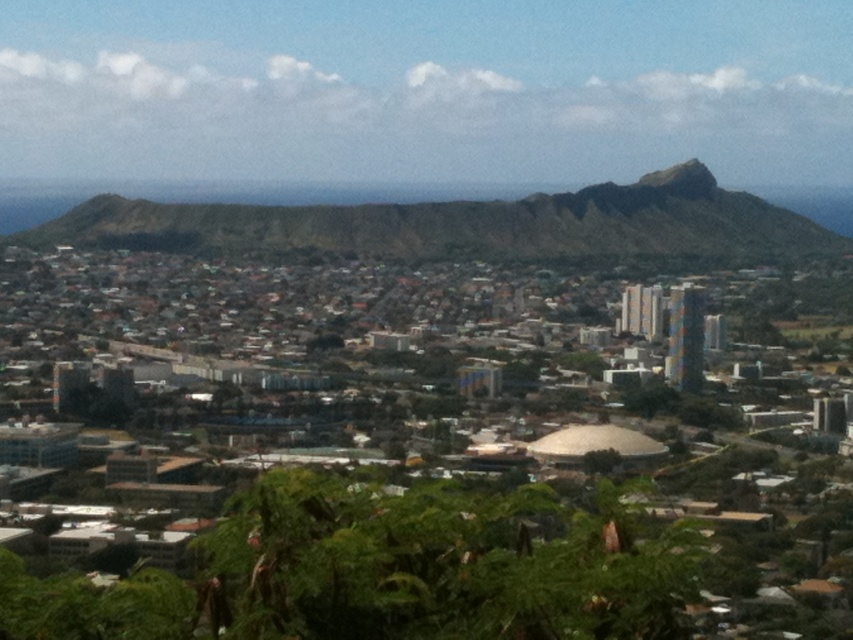
Who is positioned more to the left, brown rocky mountain at center or green mossy rock at upper center?

brown rocky mountain at center is more to the left.

Does brown rocky mountain at center appear over green mossy rock at upper center?

Incorrect, brown rocky mountain at center is not positioned above green mossy rock at upper center.

Between point (386, 212) and point (642, 180), which one is positioned behind?

Point (642, 180)

I want to click on brown rocky mountain at center, so click(x=457, y=227).